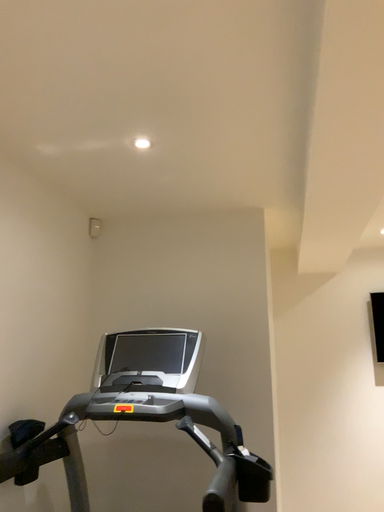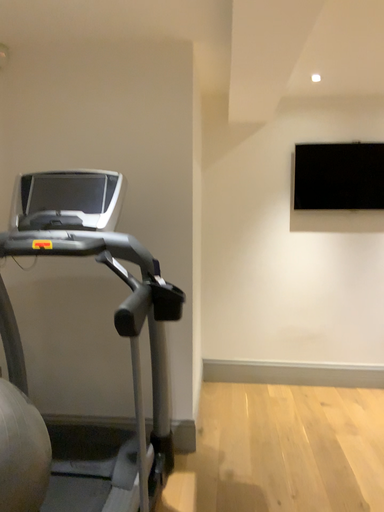
Question: Which way did the camera rotate in the video?

Choices:
 (A) rotated upward
 (B) rotated downward

Answer: (B)